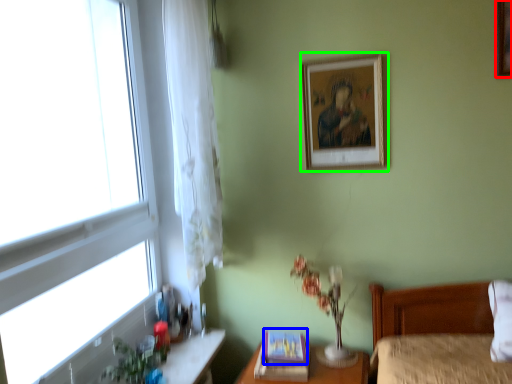
Question: Based on their relative distances, which object is farther from picture frame (highlighted by a red box)? Choose from picture frame (highlighted by a blue box) and picture frame (highlighted by a green box).

Choices:
 (A) picture frame
 (B) picture frame

Answer: (A)